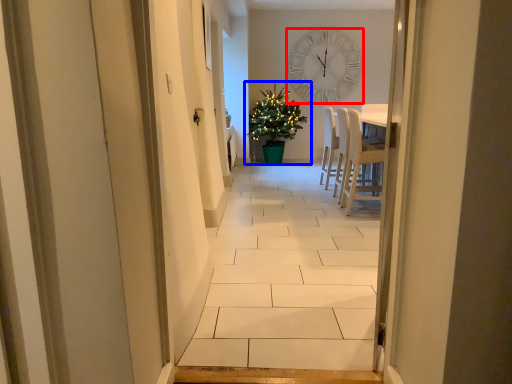
Question: Among these objects, which one is farthest to the camera, wall clock (highlighted by a red box) or houseplant (highlighted by a blue box)?

Choices:
 (A) wall clock
 (B) houseplant

Answer: (A)